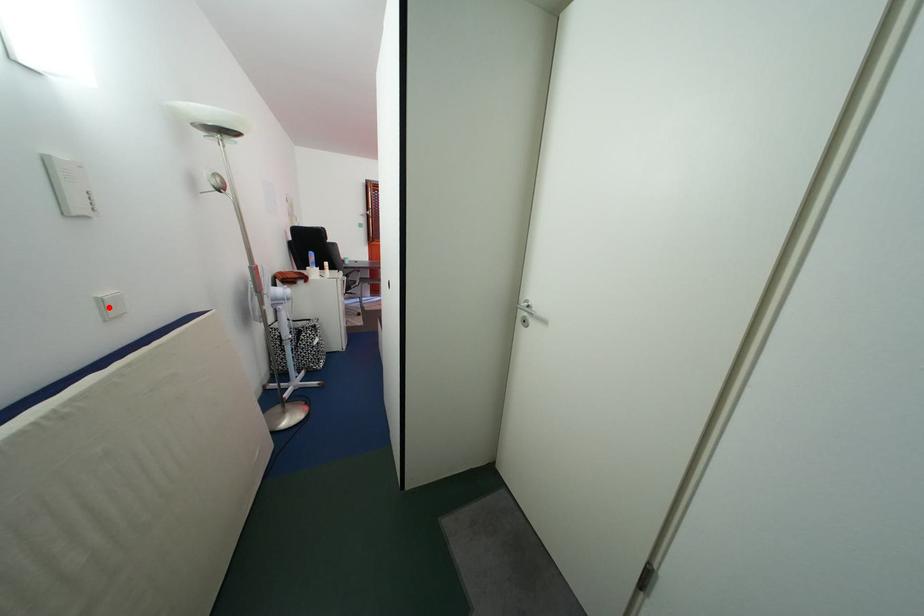
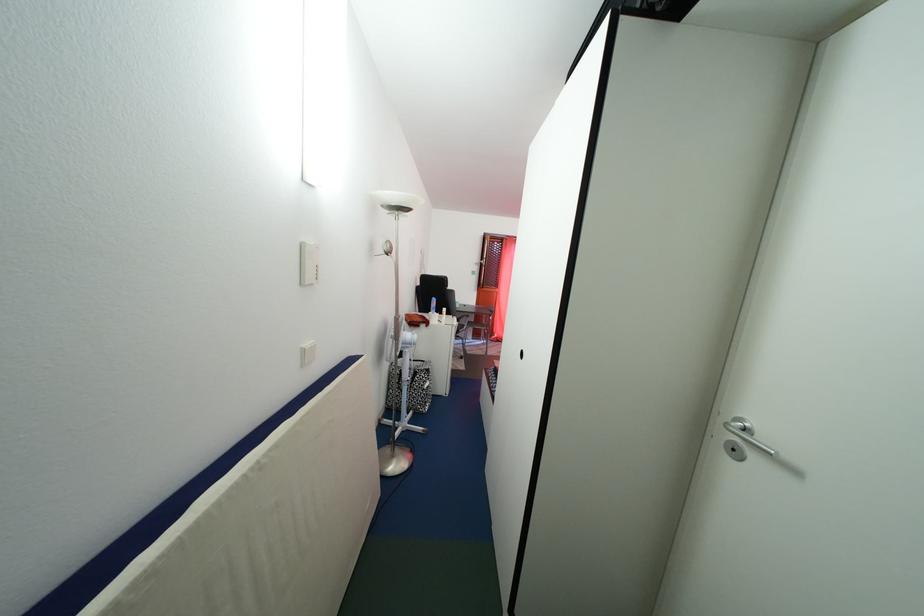
Question: I am providing you with two images of the same scene from different viewpoints. Image1 has a red point marked. In image2, the corresponding 3D location appears at what relative position? Reply with the corresponding letter.

Choices:
 (A) Closer
 (B) Farther

Answer: (A)